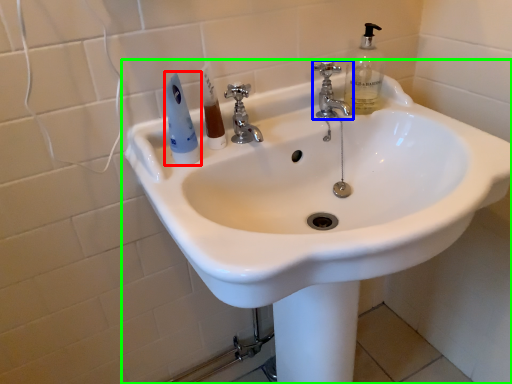
Question: Estimate the real-world distances between objects in this image. Which object is closer to mouthwash (highlighted by a red box), tap (highlighted by a blue box) or sink (highlighted by a green box)?

Choices:
 (A) tap
 (B) sink

Answer: (B)